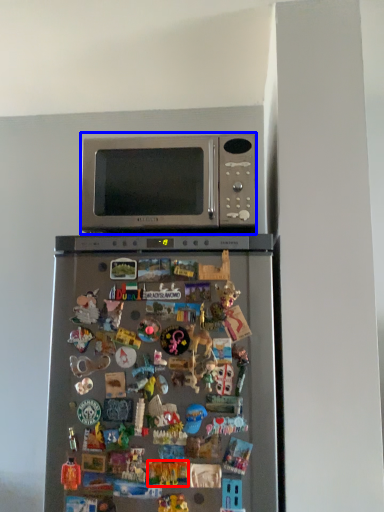
Question: Which point is further to the camera, toy (highlighted by a red box) or microwave oven (highlighted by a blue box)?

Choices:
 (A) toy
 (B) microwave oven

Answer: (B)